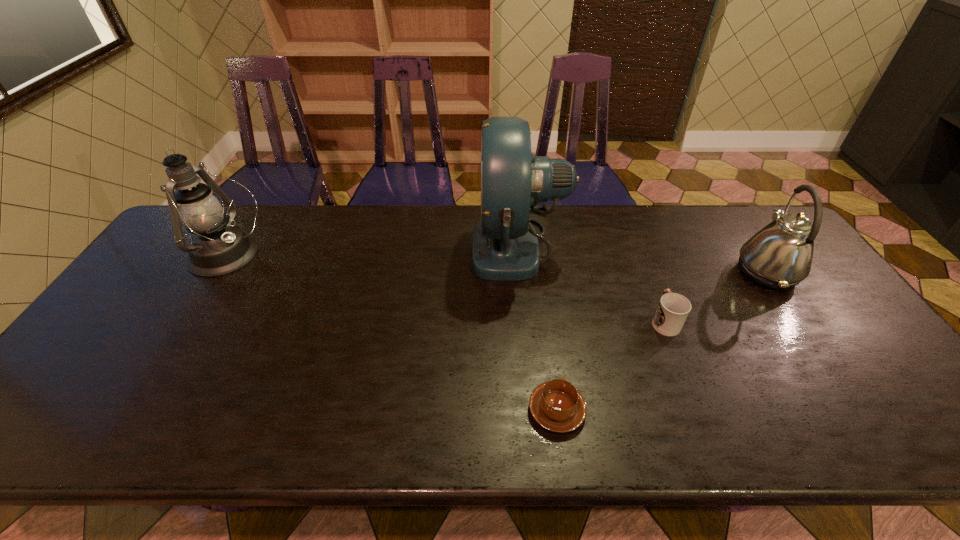
Identify the location of free area in between the cappuccino and the fan. The height and width of the screenshot is (540, 960). (538, 328).

Find the location of a particular element. This screenshot has height=540, width=960. vacant point located between the fourth object from left to right and the third shortest object is located at coordinates (715, 296).

Where is `object that is the closest to the tallest object`? object that is the closest to the tallest object is located at coordinates (673, 309).

The image size is (960, 540). Identify the location of object that is the closest to the rightmost object. (673, 309).

You are a GUI agent. You are given a task and a screenshot of the screen. Output one action in this format:
    pyautogui.click(x=<x>, y=<y>)
    Task: Click on the vacant region that satisfies the following two spatial constraints: 1. in front of the fan to blow air; 2. on the side of the second nearest object where the handle is located
    This screenshot has height=540, width=960.
    Given the screenshot: What is the action you would take?
    [x=526, y=321]

The width and height of the screenshot is (960, 540). What are the coordinates of `vacant position in the image that satisfies the following two spatial constraints: 1. on the back side of the kettle; 2. in front of the fan to blow air` in the screenshot? It's located at click(749, 247).

Find the location of a particular element. vacant region that satisfies the following two spatial constraints: 1. on the side of the shortest object with the handle; 2. in front of the fan to blow air is located at coordinates (535, 247).

Where is `free space that satisfies the following two spatial constraints: 1. in front of the fan to blow air; 2. on the side of the cappuccino with the handle`? This screenshot has height=540, width=960. free space that satisfies the following two spatial constraints: 1. in front of the fan to blow air; 2. on the side of the cappuccino with the handle is located at coordinates (535, 410).

Where is `vacant position in the image that satisfies the following two spatial constraints: 1. on the side of the second nearest object where the handle is located; 2. in front of the tallest object to blow air`? vacant position in the image that satisfies the following two spatial constraints: 1. on the side of the second nearest object where the handle is located; 2. in front of the tallest object to blow air is located at coordinates (636, 247).

Identify the location of vacant space that satisfies the following two spatial constraints: 1. in front of the fan to blow air; 2. on the side of the shortest object with the handle. (535, 410).